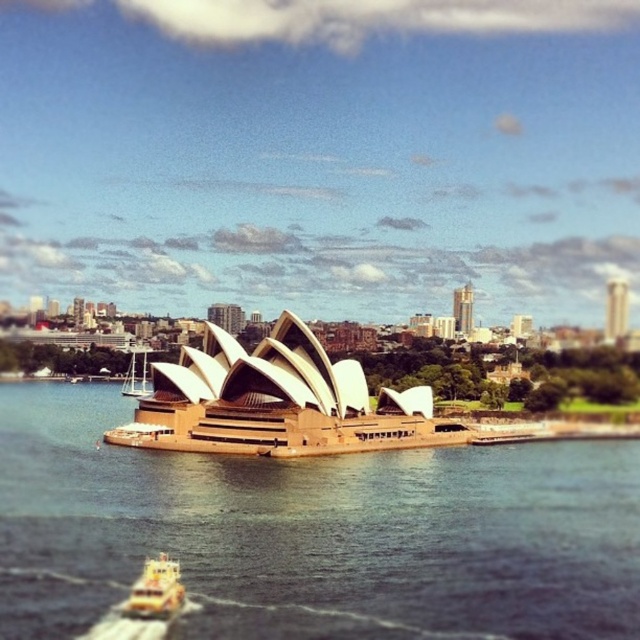
Which is more to the right, golden stone opera house at center or yellow plastic boat at lower left?

From the viewer's perspective, golden stone opera house at center appears more on the right side.

Can you confirm if golden stone opera house at center is taller than yellow plastic boat at lower left?

Indeed, golden stone opera house at center has a greater height compared to yellow plastic boat at lower left.

Which is in front, point (244, 420) or point (147, 596)?

Point (147, 596) is in front.

Find the location of a particular element. golden stone opera house at center is located at coordinates (276, 403).

Which of these two, brown water at center or yellow plastic boat at lower left, stands shorter?

Standing shorter between the two is yellow plastic boat at lower left.

Locate an element on the screen. The height and width of the screenshot is (640, 640). brown water at center is located at coordinates point(314,532).

Where is `brown water at center`? This screenshot has width=640, height=640. brown water at center is located at coordinates (314, 532).

Consider the image. Can you confirm if brown water at center is taller than golden stone opera house at center?

In fact, brown water at center may be shorter than golden stone opera house at center.

Does brown water at center appear on the left side of golden stone opera house at center?

In fact, brown water at center is to the right of golden stone opera house at center.

The height and width of the screenshot is (640, 640). Describe the element at coordinates (314, 532) in the screenshot. I see `brown water at center` at that location.

Locate an element on the screen. The image size is (640, 640). brown water at center is located at coordinates (314, 532).